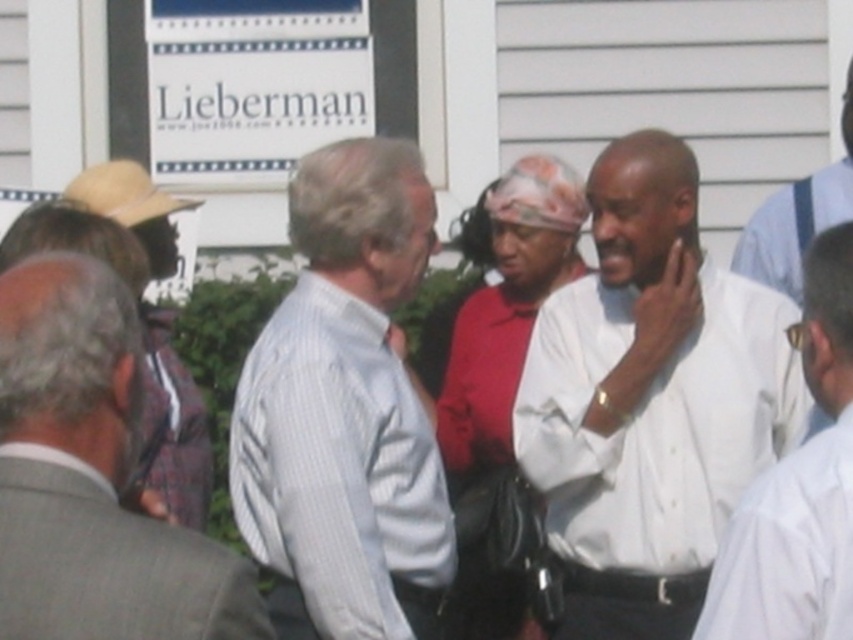
You are a photographer at the event and need to capture a group photo of the white cotton shirt at center and the white shirt at right. Which person should you focus on first to ensure they are in frame?

The white cotton shirt at center is bigger than the white shirt at right, so you should focus on the white cotton shirt at center first to ensure it is fully in frame.